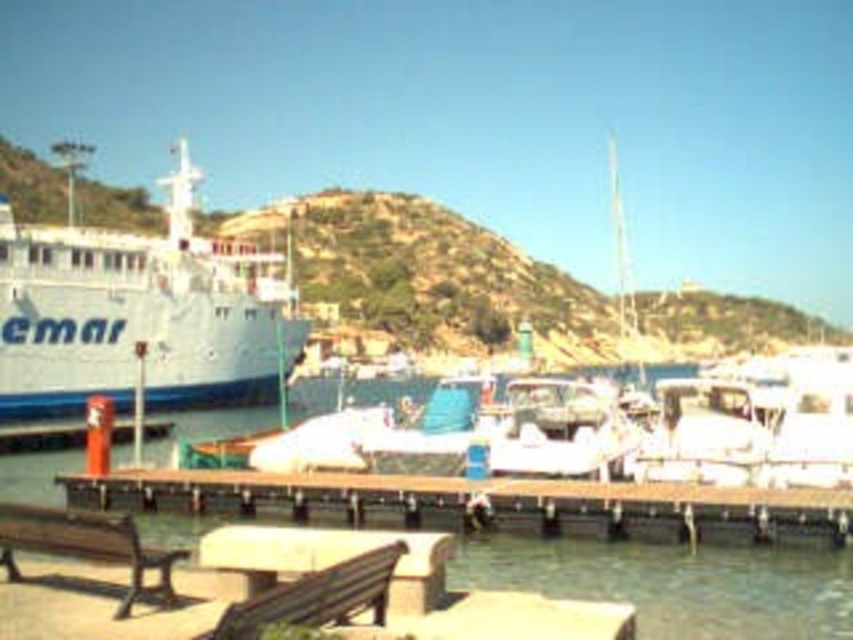
Question: Considering the relative positions of white matte cruise ship at left and wooden park bench at lower left in the image provided, where is white matte cruise ship at left located with respect to wooden park bench at lower left?

Choices:
 (A) below
 (B) above

Answer: (B)

Question: Among these points, which one is nearest to the camera?

Choices:
 (A) (175, 364)
 (B) (712, 596)
 (C) (628, 529)

Answer: (B)

Question: Which point is closer to the camera?

Choices:
 (A) (4, 234)
 (B) (842, 497)
 (C) (779, 634)

Answer: (C)

Question: Which object is positioned closest to the clear water at dock center?

Choices:
 (A) brown wooden dock at lower center
 (B) wooden park bench at lower left

Answer: (A)

Question: Is brown wooden dock at lower center wider than wooden park bench at lower left?

Choices:
 (A) no
 (B) yes

Answer: (B)

Question: Does brown wooden dock at lower center have a greater width compared to wooden park bench at lower left?

Choices:
 (A) yes
 (B) no

Answer: (A)